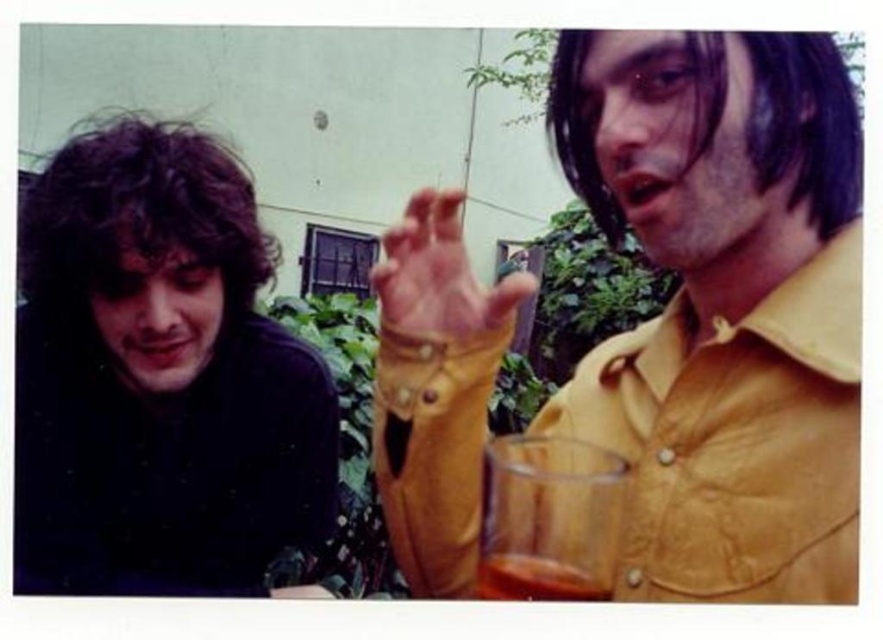
You are standing at the origin point in the image. The yellow leather shirt at upper right is located at coordinates point (723, 305). Can you determine if the yellow leather shirt at upper right is positioned to the left or right of the origin point?

The yellow leather shirt at upper right is located at coordinates point (723, 305). Since the x coordinate is 0.478, which is greater than 0.5, the yellow leather shirt at upper right is positioned to the right of the origin point.

You are an architect designing a new building and need to place a window exactly at the coordinates where the yellow leather shirt at upper right is located. What coordinates should you use?

The coordinates for the yellow leather shirt at upper right are 0.478 and 0.820, so you should place the window at those coordinates.